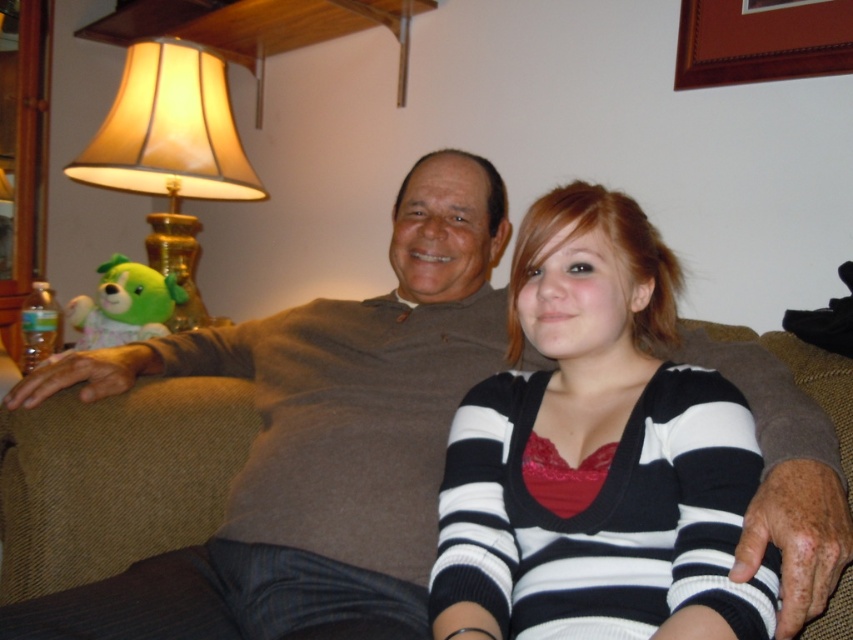
Can you confirm if beige fabric lampshade at upper left is positioned below brown wooden picture frame at upper right?

Indeed, beige fabric lampshade at upper left is positioned under brown wooden picture frame at upper right.

Who is more forward, (227, 186) or (747, 64)?

Positioned in front is point (747, 64).

Which is in front, point (213, 147) or point (688, 13)?

Point (688, 13)

Identify the location of beige fabric lampshade at upper left. The image size is (853, 640). (171, 152).

Can you confirm if striped knit sweater at center is smaller than brown wooden picture frame at upper right?

Actually, striped knit sweater at center might be larger than brown wooden picture frame at upper right.

Which is more to the left, striped knit sweater at center or brown wooden picture frame at upper right?

From the viewer's perspective, striped knit sweater at center appears more on the left side.

Identify the location of striped knit sweater at center. This screenshot has height=640, width=853. (596, 456).

Locate an element on the screen. The width and height of the screenshot is (853, 640). striped knit sweater at center is located at coordinates (596, 456).

Find the location of a particular element. The width and height of the screenshot is (853, 640). striped knit sweater at center is located at coordinates (596, 456).

Locate an element on the screen. striped knit sweater at center is located at coordinates (596, 456).